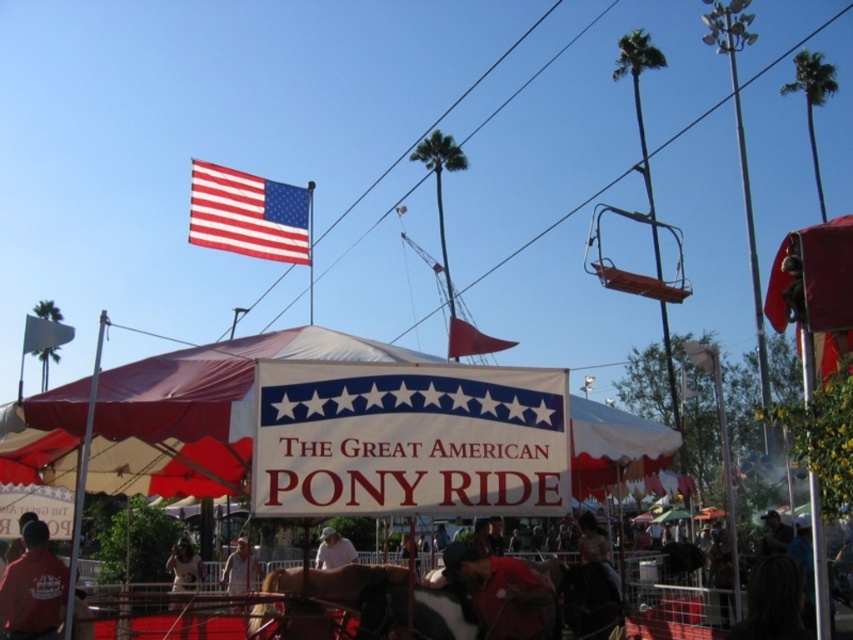
Question: Does white fabric sign at center have a greater width compared to white fabric umbrella at center?

Choices:
 (A) yes
 (B) no

Answer: (B)

Question: Among these objects, which one is farthest from the camera?

Choices:
 (A) white fabric umbrella at center
 (B) white matte shirt at center

Answer: (A)

Question: Does white matte shirt at center have a lesser width compared to white fabric umbrella at center?

Choices:
 (A) no
 (B) yes

Answer: (A)

Question: Which object appears farthest from the camera in this image?

Choices:
 (A) white matte shirt at center
 (B) white fabric sign at center

Answer: (A)

Question: Is red-white-and-blue fabric flag at upper center bigger than light brown leather jacket at center?

Choices:
 (A) yes
 (B) no

Answer: (B)

Question: Which point appears closest to the camera in this image?

Choices:
 (A) (326, 568)
 (B) (770, 534)

Answer: (A)